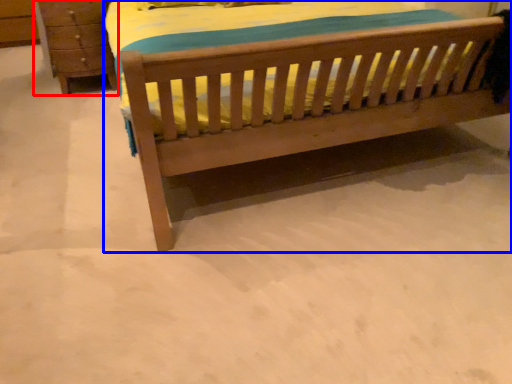
Question: Which object appears farthest to the camera in this image, chest of drawers (highlighted by a red box) or bed (highlighted by a blue box)?

Choices:
 (A) chest of drawers
 (B) bed

Answer: (A)